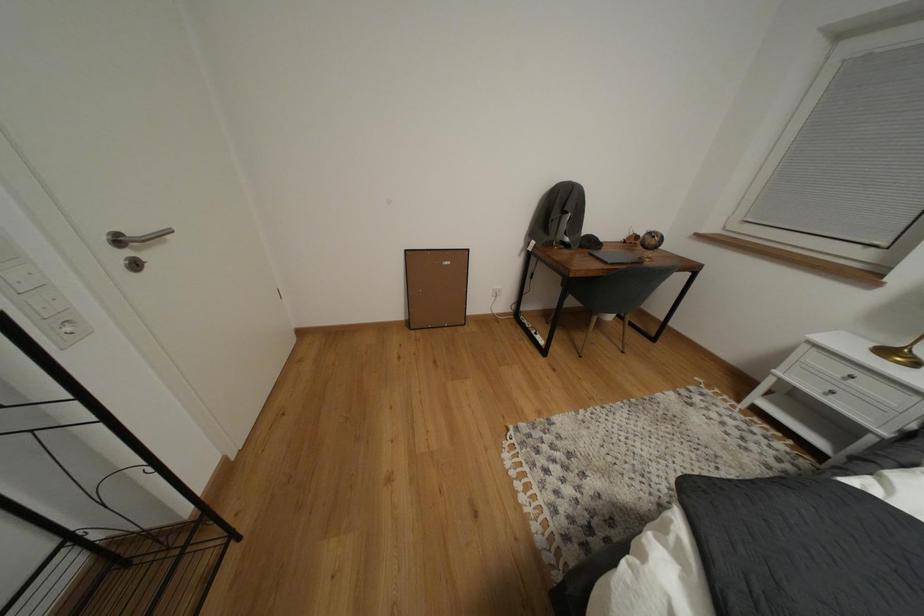
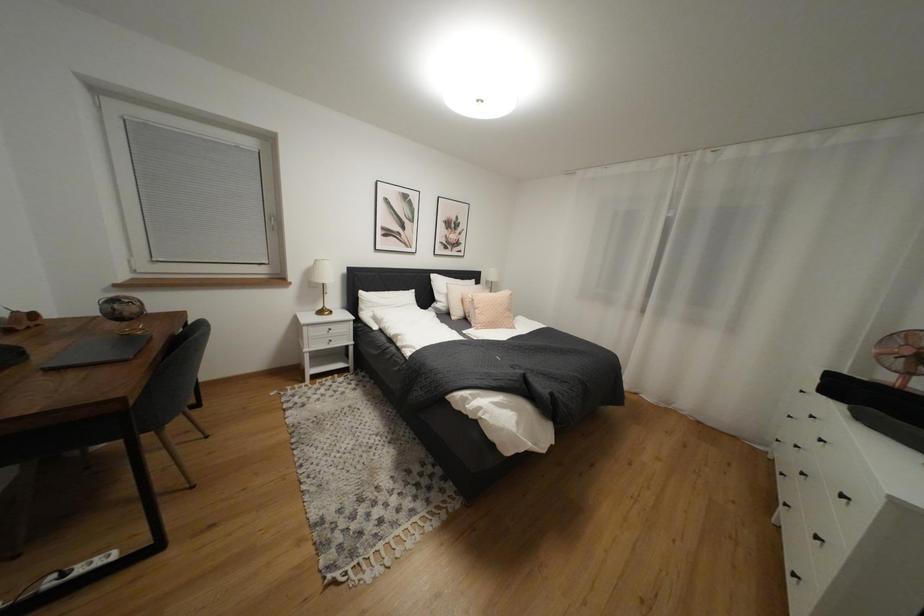
The first image is from the beginning of the video and the second image is from the end. How did the camera likely rotate when shooting the video?

The rotation direction of the camera is right-down.